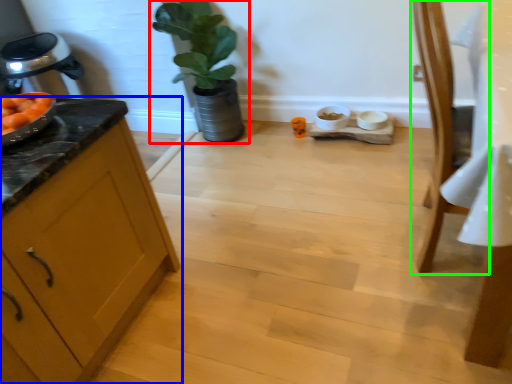
Question: Which object is positioned closest to houseplant (highlighted by a red box)? Select from cabinetry (highlighted by a blue box) and chair (highlighted by a green box).

Choices:
 (A) cabinetry
 (B) chair

Answer: (A)